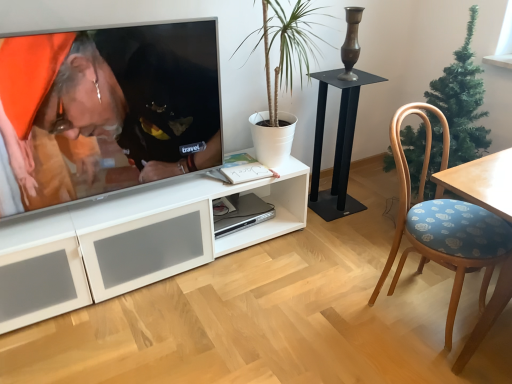
This screenshot has height=384, width=512. Identify the location of empty space that is in between black metal table at center and wooden chair with blue floral cushion at right. (357, 244).